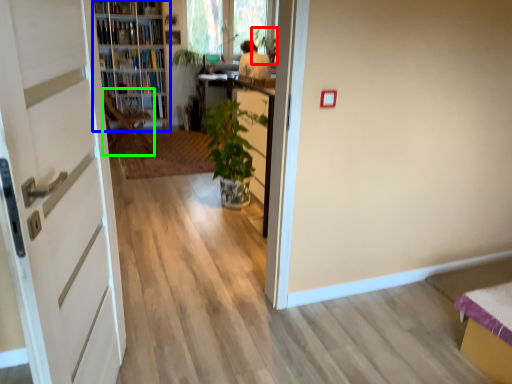
Question: Estimate the real-world distances between objects in this image. Which object is closer to plant (highlighted by a red box), shelf (highlighted by a blue box) or chair (highlighted by a green box)?

Choices:
 (A) shelf
 (B) chair

Answer: (A)